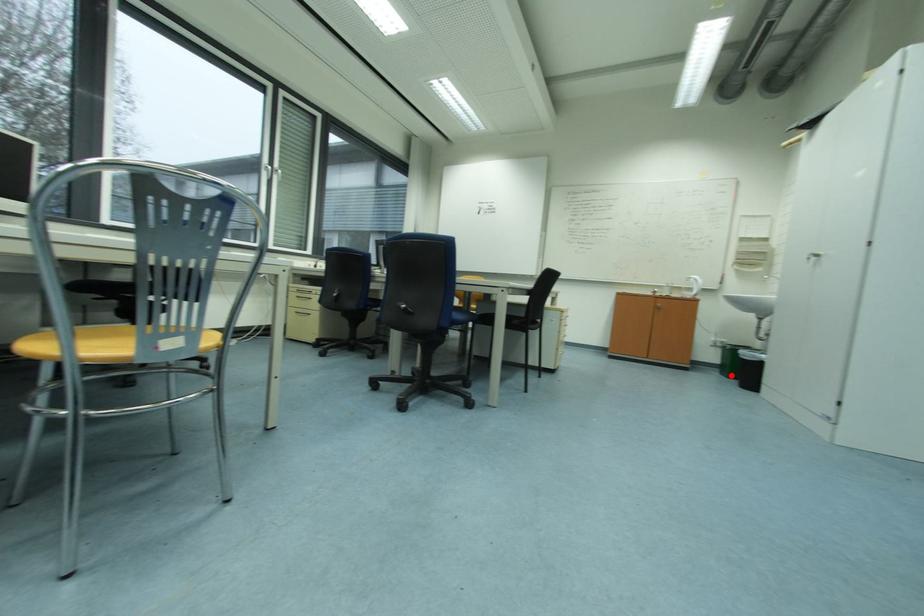
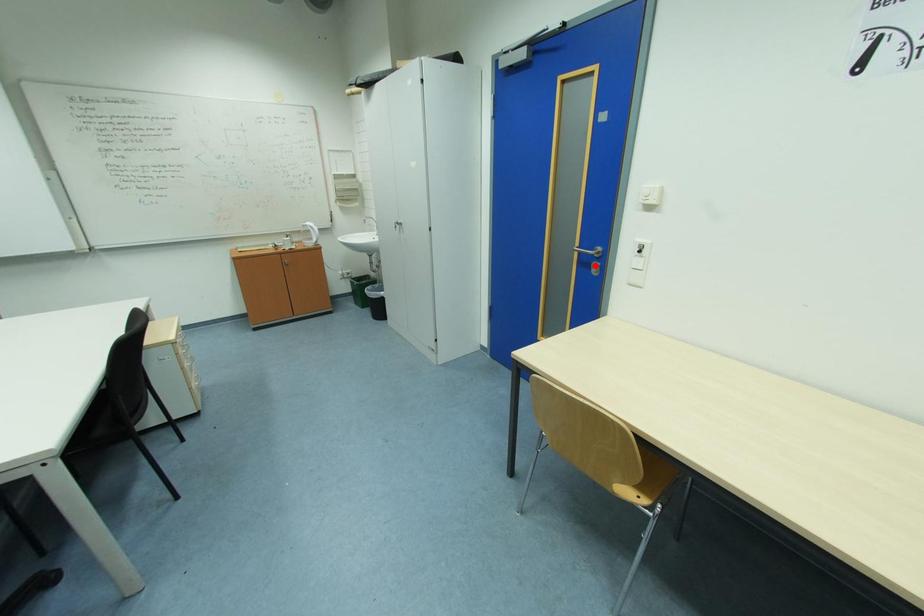
I am providing you with two images of the same scene from different viewpoints. A red point is marked on the first image and another point is marked on the second image. Is the marked point in image1 the same physical position as the marked point in image2?

No